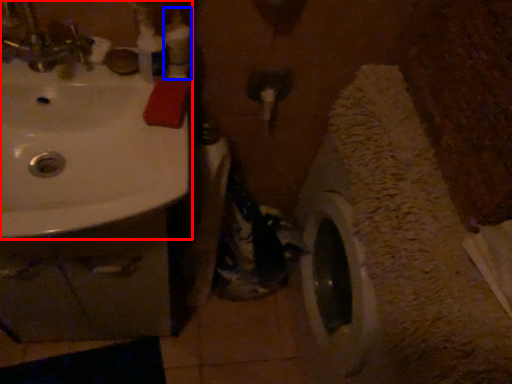
Question: Which of the following is the farthest to the observer, sink (highlighted by a red box) or toiletry (highlighted by a blue box)?

Choices:
 (A) sink
 (B) toiletry

Answer: (B)